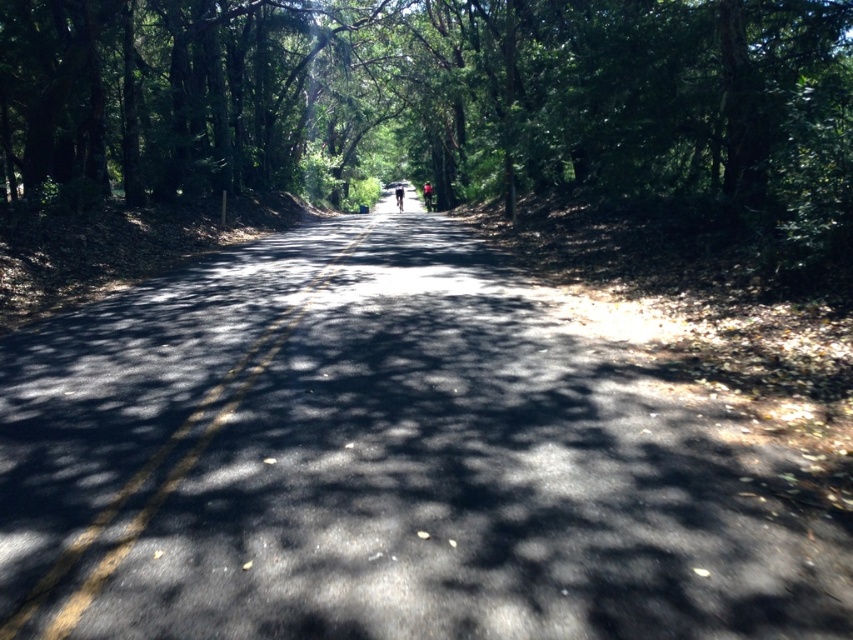
Question: Which of the following is the farthest from the observer?

Choices:
 (A) green fabric person at center
 (B) green leafy trees at center
 (C) dark blue fabric umbrella at center

Answer: (A)

Question: Can you confirm if green fabric person at center is smaller than dark blue fabric umbrella at center?

Choices:
 (A) no
 (B) yes

Answer: (B)

Question: Is green fabric person at center bigger than dark blue fabric umbrella at center?

Choices:
 (A) no
 (B) yes

Answer: (A)

Question: Is green leafy trees at center further to the viewer compared to green fabric person at center?

Choices:
 (A) no
 (B) yes

Answer: (A)

Question: Among these objects, which one is nearest to the camera?

Choices:
 (A) green fabric person at center
 (B) green leafy trees at center
 (C) dark blue fabric umbrella at center

Answer: (B)

Question: Which object appears closest to the camera in this image?

Choices:
 (A) green leafy trees at center
 (B) green fabric person at center

Answer: (A)